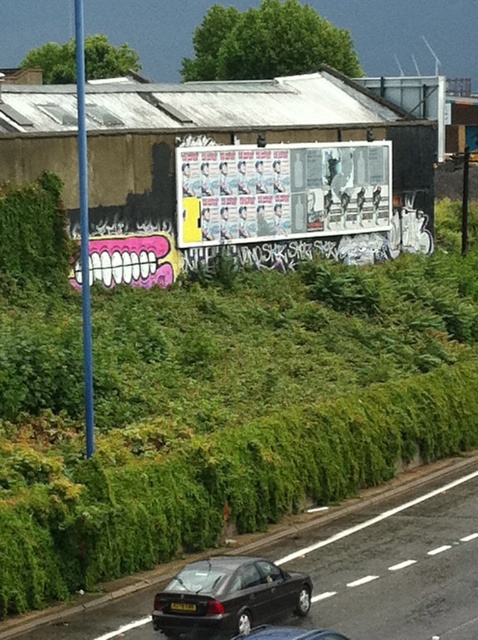
You are a delivery driver trying to park your shiny black sedan at center. There is a green leafy hedge at upper center nearby. Can you fit your car between the hedge and the road without hitting anything?

The green leafy hedge at upper center might be wider than the shiny black sedan at center, so there might be enough space to park without hitting anything. However, since the exact width difference isn not specified, proceed with caution.

You are a delivery driver who needs to park your 1.8 meter wide van between the shiny black sedan at lower center and the yellow matte license plate at center. Is there enough space?

The shiny black sedan at lower center might be wider than the yellow matte license plate at center, so there may not be enough space for the van to park between them.

Based on the photo, you are a pedestrian trying to cross the street and see the green leafy hedge at upper center and the shiny black sedan at center. Which object is closer to you?

The green leafy hedge at upper center is closer to you because the shiny black sedan at center is behind it.